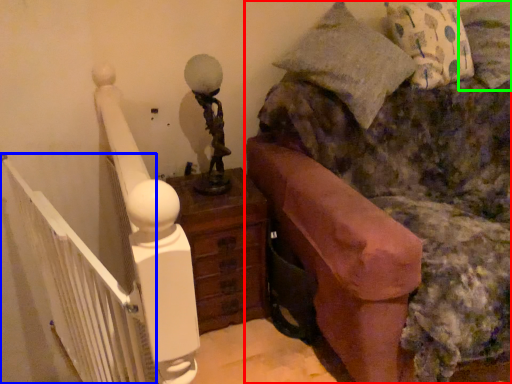
Question: Which is farther away from furniture (highlighted by a red box)? balustrade (highlighted by a blue box) or pillow (highlighted by a green box)?

Choices:
 (A) balustrade
 (B) pillow

Answer: (A)